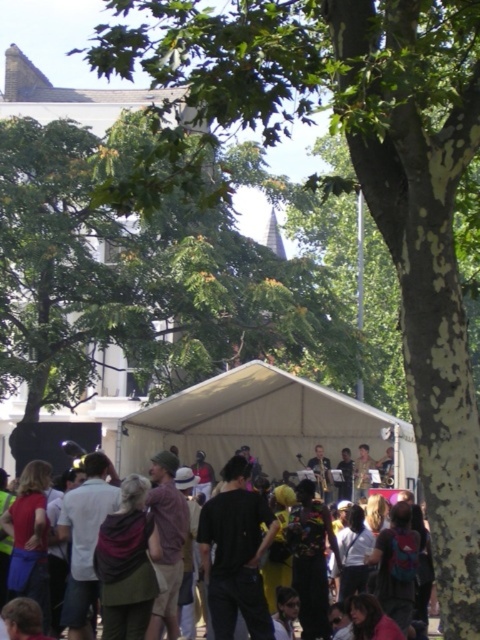
You are attending an outdoor event and notice two fabric structures at the center. Which one is above the other? The white fabric canopy at center or the black fabric tent at center?

The white fabric canopy at center is positioned over the black fabric tent at center.

You are a photographer standing at the edge of the crowd. You want to take a photo that includes both the green leafy tree at upper center and the white fabric canopy at center. Given that your camera has a maximum focus range of 20 meters, will you be able to capture both objects in sharp focus in a single shot?

The green leafy tree at upper center is 21.29 meters from the white fabric canopy at center. Since the distance between them exceeds the camera maximum focus range of 20 meters, you cannot capture both objects in sharp focus in a single shot.

You are a photographer trying to capture the entire scene of the event. You notice the green leafy tree at upper center and the black fabric tent at center. Which object is wider in the image?

The green leafy tree at upper center is wider than the black fabric tent at center according to the description.